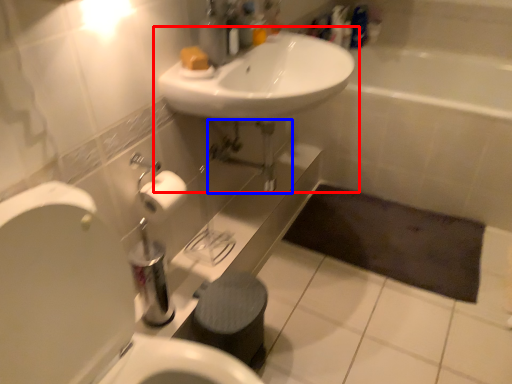
Question: Which point is closer to the camera, sink (highlighted by a red box) or plumbing fixture (highlighted by a blue box)?

Choices:
 (A) sink
 (B) plumbing fixture

Answer: (A)